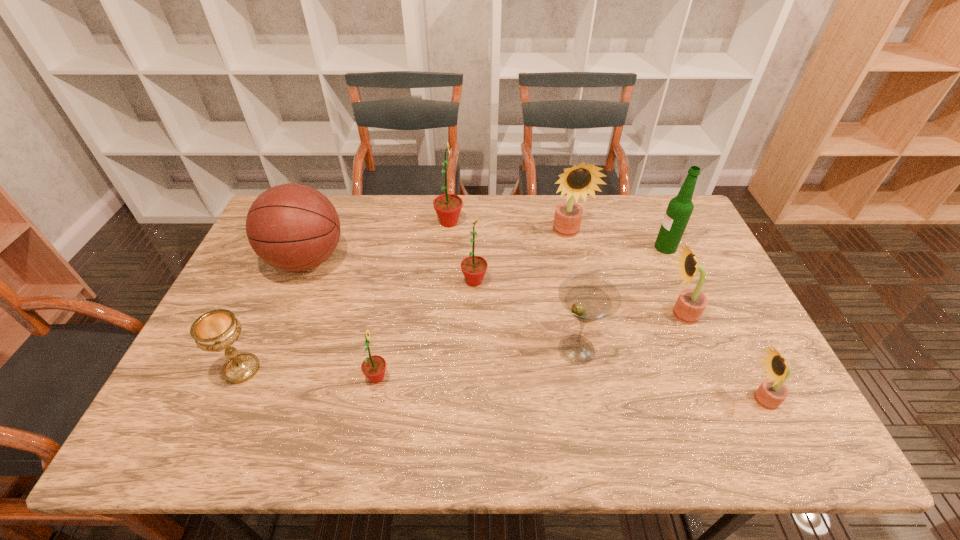
The image size is (960, 540). Find the location of `vacant region located on the label of the green beer bottle`. vacant region located on the label of the green beer bottle is located at coordinates (626, 247).

Image resolution: width=960 pixels, height=540 pixels. In order to click on vacant space positioned 0.130m on the front of the basketball in this screenshot , I will do `click(280, 325)`.

Locate an element on the screen. vacant space positioned 0.280m on the face of the second farthest yellow sunflower is located at coordinates (560, 314).

Image resolution: width=960 pixels, height=540 pixels. Find the location of `vacant area located 0.320m on the face of the second farthest yellow sunflower`. vacant area located 0.320m on the face of the second farthest yellow sunflower is located at coordinates (545, 314).

Find the location of a particular element. The width and height of the screenshot is (960, 540). free space located 0.390m on the face of the second farthest yellow sunflower is located at coordinates (519, 314).

This screenshot has height=540, width=960. Identify the location of vacant region located on the face of the second farthest green sunflower. (616, 281).

Locate an element on the screen. free space located on the right of the martini is located at coordinates (760, 349).

You are a GUI agent. You are given a task and a screenshot of the screen. Output one action in this format:
    pyautogui.click(x=<x>, y=<y>)
    Task: Click on the free space located on the face of the smallest yellow sunflower
    
    Given the screenshot: What is the action you would take?
    pyautogui.click(x=684, y=400)

The width and height of the screenshot is (960, 540). I want to click on vacant space positioned 0.290m on the face of the smallest yellow sunflower, so click(x=620, y=400).

Where is `free space located on the face of the smallest yellow sunflower`? Image resolution: width=960 pixels, height=540 pixels. free space located on the face of the smallest yellow sunflower is located at coordinates (641, 400).